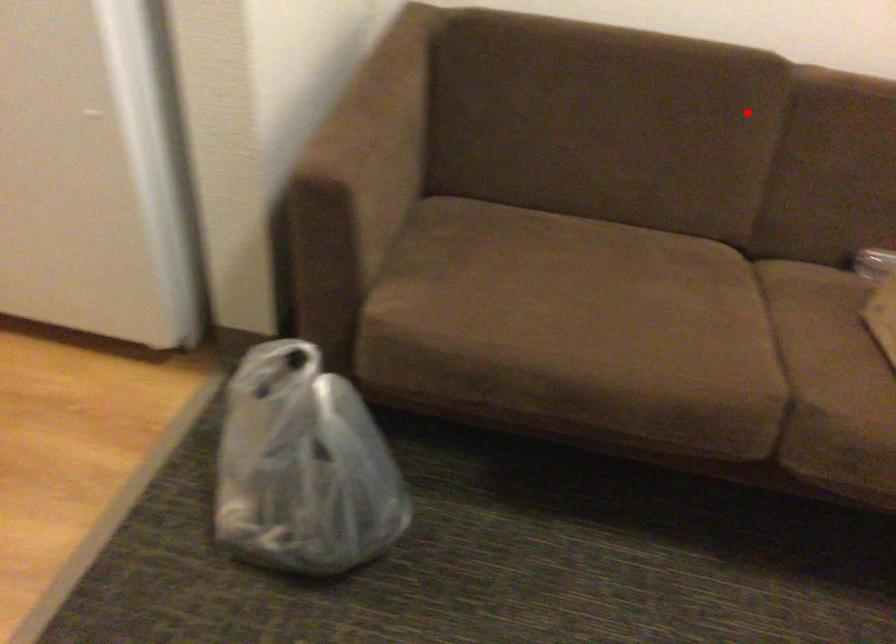
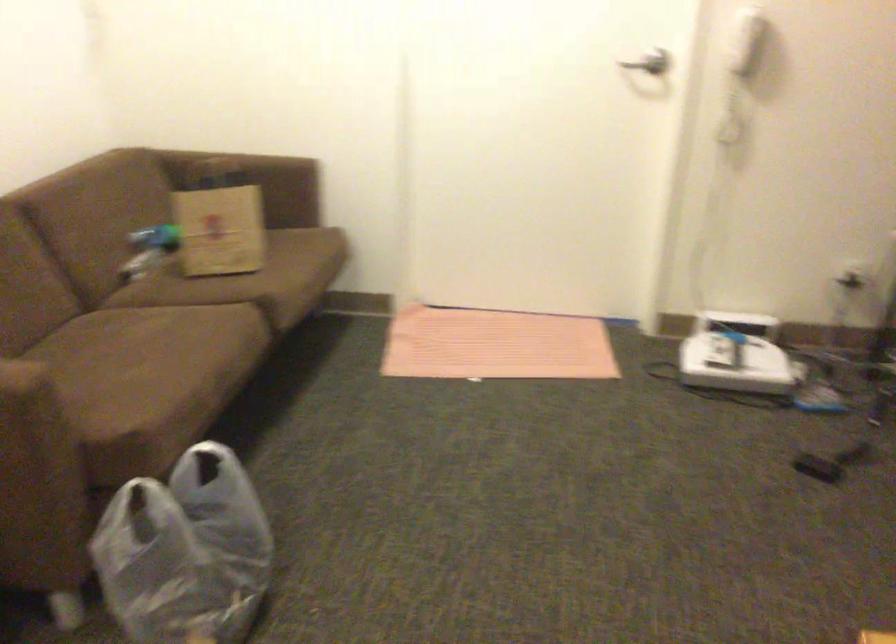
Question: A red point is marked in image1. In image2, is the corresponding 3D point closer to the camera or farther? Reply with the corresponding letter.

Choices:
 (A) The corresponding 3D point is closer.
 (B) The corresponding 3D point is farther.

Answer: (B)